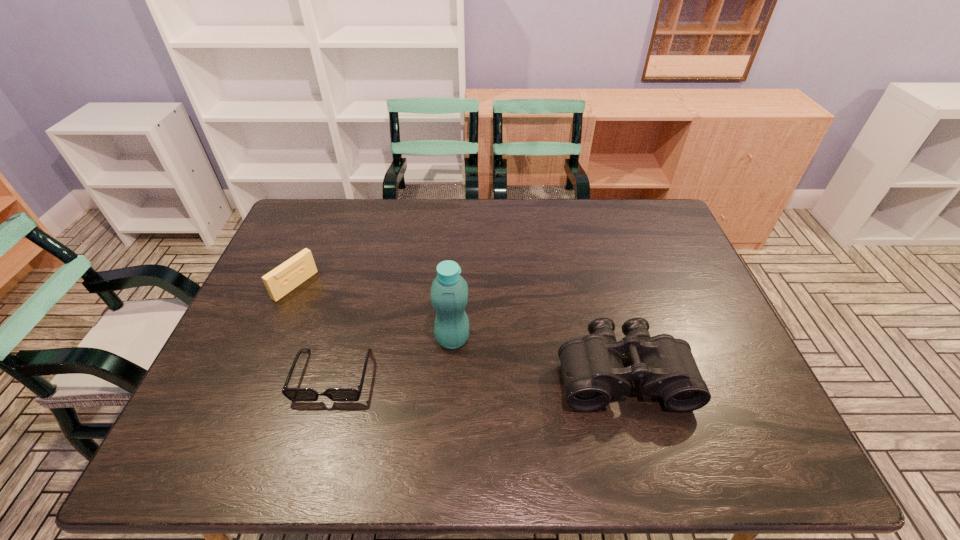
The width and height of the screenshot is (960, 540). I want to click on free space on the desktop that is between the third object from right to left and the binoculars and is positioned at the front of the videotape with spools, so click(442, 375).

Image resolution: width=960 pixels, height=540 pixels. In order to click on vacant space on the desktop that is between the shortest object and the binoculars and is positioned at the front cap of the water bottle in this screenshot , I will do `click(521, 375)`.